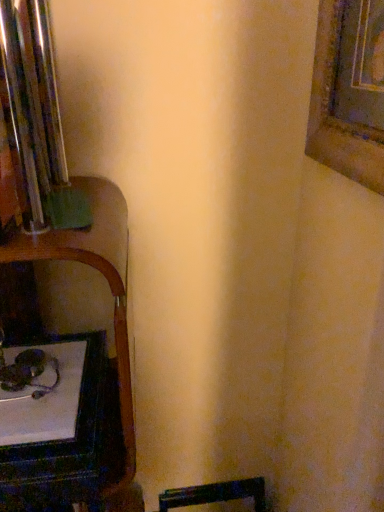
Question: Considering the relative sizes of white glossy table at lower left and wooden picture frame at upper right in the image provided, is white glossy table at lower left thinner than wooden picture frame at upper right?

Choices:
 (A) yes
 (B) no

Answer: (B)

Question: Is white glossy table at lower left positioned with its back to wooden picture frame at upper right?

Choices:
 (A) yes
 (B) no

Answer: (B)

Question: Is white glossy table at lower left further to the viewer compared to wooden picture frame at upper right?

Choices:
 (A) yes
 (B) no

Answer: (A)

Question: From a real-world perspective, is white glossy table at lower left beneath wooden picture frame at upper right?

Choices:
 (A) no
 (B) yes

Answer: (B)

Question: Can you confirm if white glossy table at lower left is wider than wooden picture frame at upper right?

Choices:
 (A) yes
 (B) no

Answer: (A)

Question: Would you consider white glossy table at lower left to be distant from wooden picture frame at upper right?

Choices:
 (A) no
 (B) yes

Answer: (A)

Question: Is wooden picture frame at upper right far away from white glossy table at lower left?

Choices:
 (A) no
 (B) yes

Answer: (A)

Question: Is wooden picture frame at upper right positioned beyond the bounds of white glossy table at lower left?

Choices:
 (A) no
 (B) yes

Answer: (B)

Question: Is wooden picture frame at upper right wider than white glossy table at lower left?

Choices:
 (A) no
 (B) yes

Answer: (A)

Question: Can you confirm if wooden picture frame at upper right is taller than white glossy table at lower left?

Choices:
 (A) yes
 (B) no

Answer: (A)

Question: From the image's perspective, is wooden picture frame at upper right over white glossy table at lower left?

Choices:
 (A) yes
 (B) no

Answer: (A)

Question: Does wooden picture frame at upper right turn towards white glossy table at lower left?

Choices:
 (A) no
 (B) yes

Answer: (A)

Question: Is point (349, 132) positioned closer to the camera than point (8, 445)?

Choices:
 (A) farther
 (B) closer

Answer: (A)